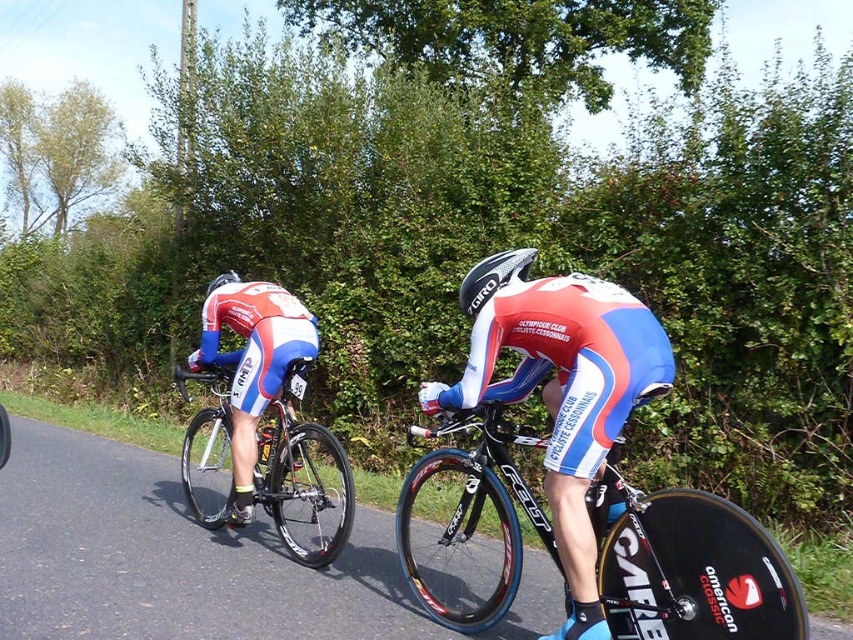
Question: Does matte blue and white cycling suit at center appear on the right side of glossy carbon fiber bicycle helmet at center?

Choices:
 (A) yes
 (B) no

Answer: (A)

Question: Does matte blue and white cycling suit at center have a larger size compared to matte white helmet at upper left?

Choices:
 (A) no
 (B) yes

Answer: (A)

Question: Does shiny black frame at center appear on the right side of glossy carbon fiber bicycle helmet at center?

Choices:
 (A) no
 (B) yes

Answer: (B)

Question: Based on their relative distances, which object is farther from the matte blue and white cycling suit at center?

Choices:
 (A) matte white helmet at upper left
 (B) shiny black frame at center

Answer: (A)

Question: Based on their relative distances, which object is farther from the white/blue/red jersey at center?

Choices:
 (A) glossy carbon fiber bicycle helmet at center
 (B) matte white helmet at upper left
 (C) shiny silver bicycle at left

Answer: (A)

Question: Which point is farther to the camera?

Choices:
 (A) (283, 320)
 (B) (473, 316)
 (C) (486, 609)

Answer: (A)